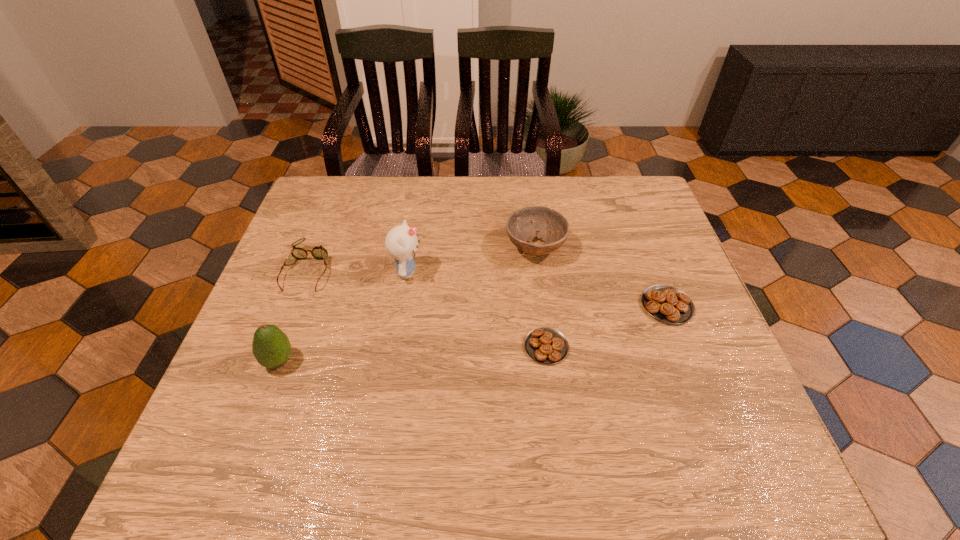
Find the location of a particular element. The height and width of the screenshot is (540, 960). free space that satisfies the following two spatial constraints: 1. on the front-facing side of the taller pastry; 2. on the right side of the fourth tallest object is located at coordinates (294, 306).